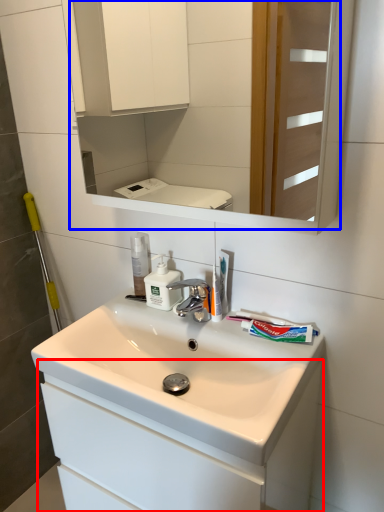
Question: Which of the following is the farthest to the observer, bathroom cabinet (highlighted by a red box) or mirror (highlighted by a blue box)?

Choices:
 (A) bathroom cabinet
 (B) mirror

Answer: (A)